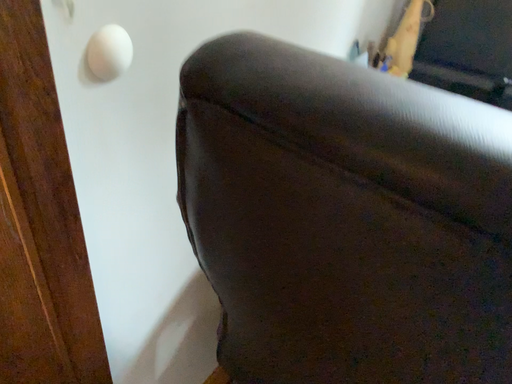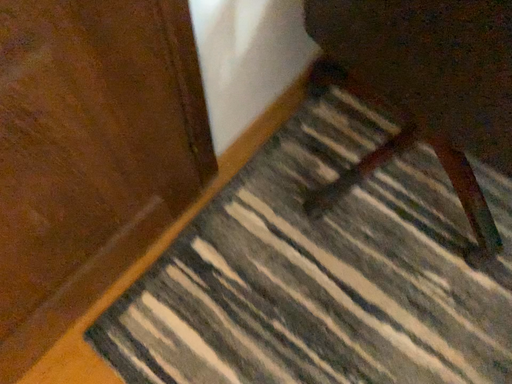
Question: Which way did the camera rotate in the video?

Choices:
 (A) rotated upward
 (B) rotated downward

Answer: (B)